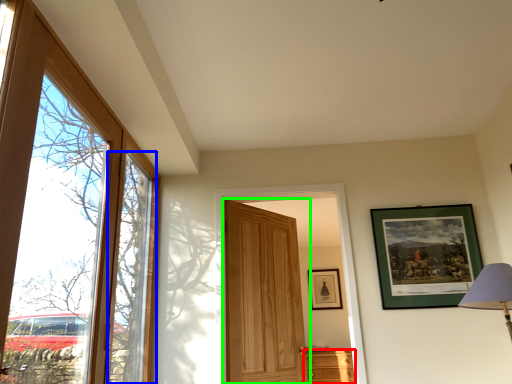
Question: Which is farther away from cabinetry (highlighted by a red box)? window (highlighted by a blue box) or door (highlighted by a green box)?

Choices:
 (A) window
 (B) door

Answer: (A)